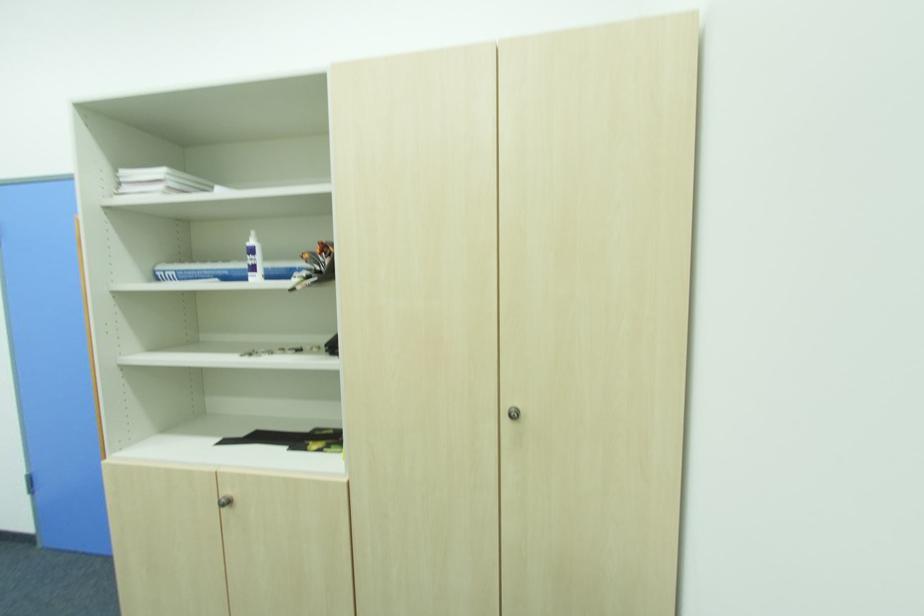
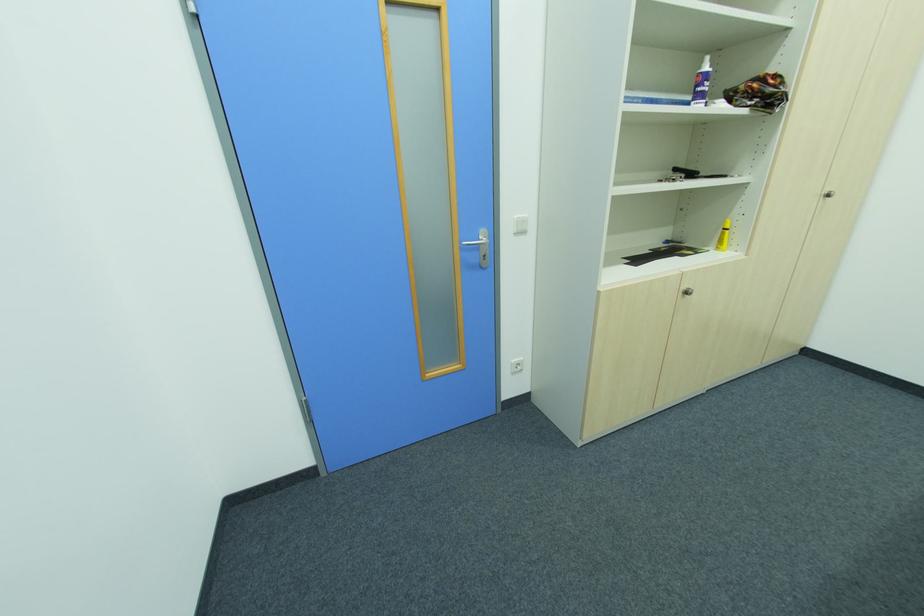
In the second image, find the point that corresponds to (229,504) in the first image.

(689, 294)